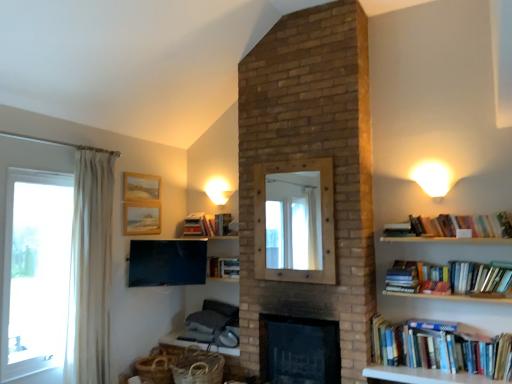
Identify the location of free spot above wooden mirror at center (from a real-world perspective). (292, 162).